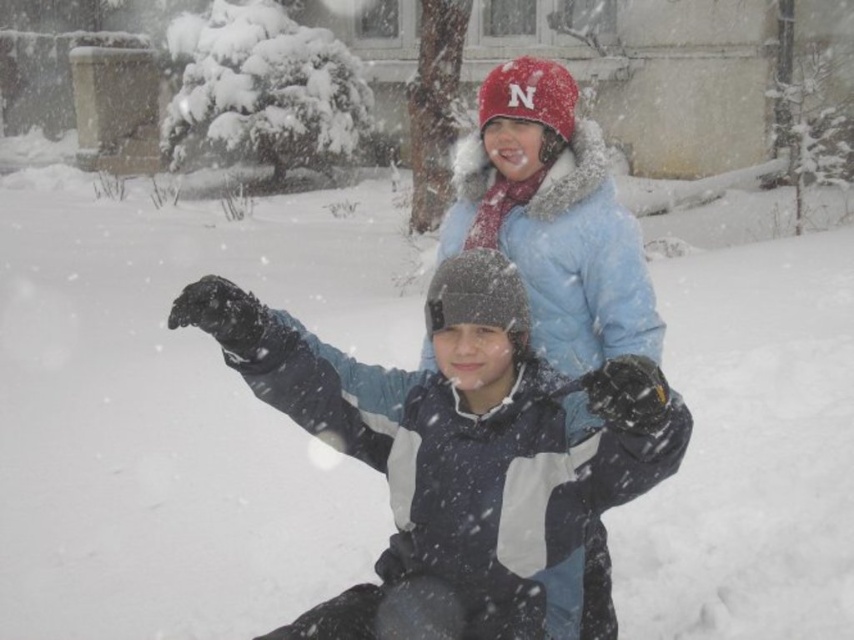
Question: Can you confirm if matte black jacket at center is positioned to the left of light blue down jacket at upper center?

Choices:
 (A) yes
 (B) no

Answer: (A)

Question: Is matte black jacket at center bigger than light blue down jacket at upper center?

Choices:
 (A) yes
 (B) no

Answer: (A)

Question: Is matte black jacket at center to the right of light blue down jacket at upper center from the viewer's perspective?

Choices:
 (A) no
 (B) yes

Answer: (A)